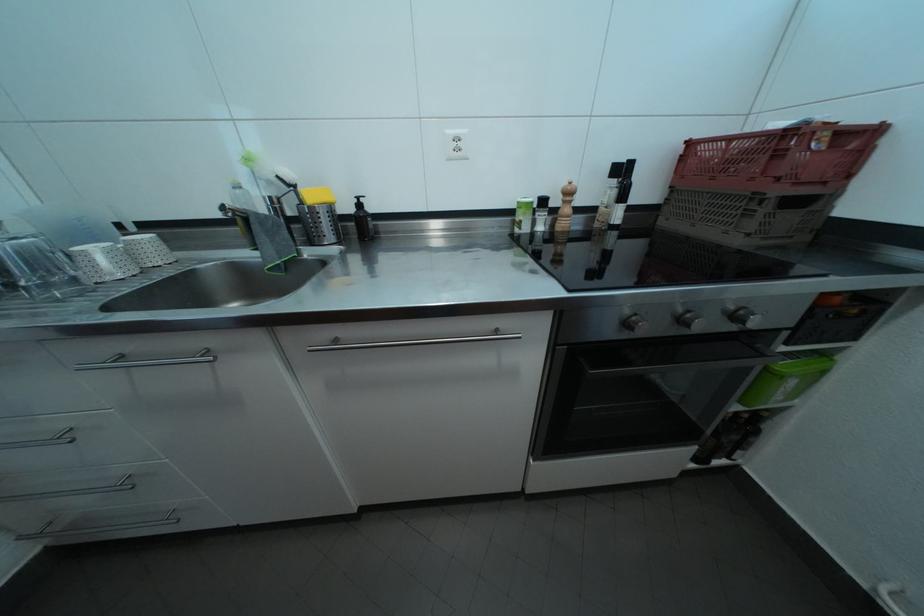
Locate an element on the screen. metal cabinet handle is located at coordinates (147, 361).